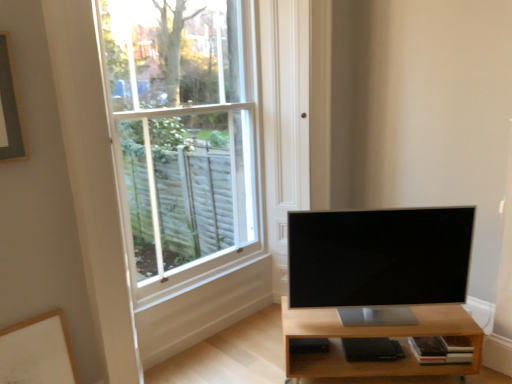
Identify the location of vacant space underneath satin black tv at center (from a real-world perspective). The image size is (512, 384). (387, 316).